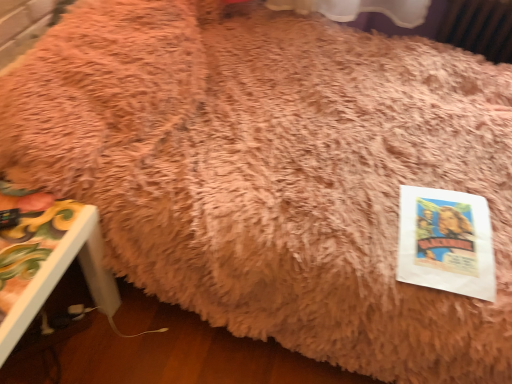
I want to click on painted wood side table at lower left, so click(x=49, y=265).

Image resolution: width=512 pixels, height=384 pixels. What do you see at coordinates (49, 265) in the screenshot?
I see `painted wood side table at lower left` at bounding box center [49, 265].

This screenshot has height=384, width=512. What do you see at coordinates (446, 242) in the screenshot?
I see `white paper at lower right` at bounding box center [446, 242].

In order to click on white paper at lower right in this screenshot , I will do `click(446, 242)`.

This screenshot has height=384, width=512. I want to click on painted wood side table at lower left, so click(49, 265).

Is white paper at lower right to the left of painted wood side table at lower left from the viewer's perspective?

Incorrect, white paper at lower right is not on the left side of painted wood side table at lower left.

Is the depth of white paper at lower right less than that of painted wood side table at lower left?

No, white paper at lower right is further to the viewer.

Considering the points (405, 214) and (6, 208), which point is in front, point (405, 214) or point (6, 208)?

The point (6, 208) is closer to the camera.

From the image's perspective, is white paper at lower right above or below painted wood side table at lower left?

Based on their image positions, white paper at lower right is located above painted wood side table at lower left.

From a real-world perspective, is white paper at lower right below painted wood side table at lower left?

Incorrect, from a real-world perspective, white paper at lower right is higher than painted wood side table at lower left.

Between white paper at lower right and painted wood side table at lower left, which one has smaller width?

Thinner between the two is white paper at lower right.

From their relative heights in the image, would you say white paper at lower right is taller or shorter than painted wood side table at lower left?

Clearly, white paper at lower right is shorter compared to painted wood side table at lower left.

Which of these two, white paper at lower right or painted wood side table at lower left, is bigger?

painted wood side table at lower left.

Would you say painted wood side table at lower left is part of white paper at lower right's contents?

No, painted wood side table at lower left is not inside white paper at lower right.

Is white paper at lower right touching painted wood side table at lower left?

white paper at lower right and painted wood side table at lower left are clearly separated.

Is white paper at lower right turned away from painted wood side table at lower left?

No, white paper at lower right is not facing away from painted wood side table at lower left.

What's the angular difference between white paper at lower right and painted wood side table at lower left's facing directions?

The angle between the facing direction of white paper at lower right and the facing direction of painted wood side table at lower left is 89.6 degrees.

Find the location of `paperback book located above the painted wood side table at lower left (from a real-world perspective)`. paperback book located above the painted wood side table at lower left (from a real-world perspective) is located at coordinates (446, 242).

Considering the relative positions of painted wood side table at lower left and white paper at lower right in the image provided, is painted wood side table at lower left to the right of white paper at lower right from the viewer's perspective?

Incorrect, painted wood side table at lower left is not on the right side of white paper at lower right.

Does painted wood side table at lower left come behind white paper at lower right?

No, painted wood side table at lower left is closer to the camera.

Which is less distant, (x=26, y=326) or (x=458, y=229)?

Point (x=26, y=326).

From the image's perspective, is painted wood side table at lower left beneath white paper at lower right?

Indeed, from the image's perspective, painted wood side table at lower left is shown beneath white paper at lower right.

From a real-world perspective, does painted wood side table at lower left stand above white paper at lower right?

No, from a real-world perspective, painted wood side table at lower left is not above white paper at lower right.

In the scene shown: Is painted wood side table at lower left wider or thinner than white paper at lower right?

Considering their sizes, painted wood side table at lower left looks broader than white paper at lower right.

Can you confirm if painted wood side table at lower left is taller than white paper at lower right?

Yes.

Considering the sizes of objects painted wood side table at lower left and white paper at lower right in the image provided, who is bigger, painted wood side table at lower left or white paper at lower right?

painted wood side table at lower left is bigger.

In the scene shown: Do you think painted wood side table at lower left is within white paper at lower right, or outside of it?

painted wood side table at lower left is not enclosed by white paper at lower right.

Is painted wood side table at lower left placed right next to white paper at lower right?

No, painted wood side table at lower left is not making contact with white paper at lower right.

Is painted wood side table at lower left facing away from white paper at lower right?

No, white paper at lower right is not at the back of painted wood side table at lower left.

What's the angular difference between painted wood side table at lower left and white paper at lower right's facing directions?

89.6 degrees.

Image resolution: width=512 pixels, height=384 pixels. I want to click on paperback book that appears on the right of painted wood side table at lower left, so click(446, 242).

The image size is (512, 384). I want to click on paperback book lying behind the painted wood side table at lower left, so click(446, 242).

In the image, there is a painted wood side table at lower left. Identify the location of paperback book above it (from the image's perspective). (446, 242).